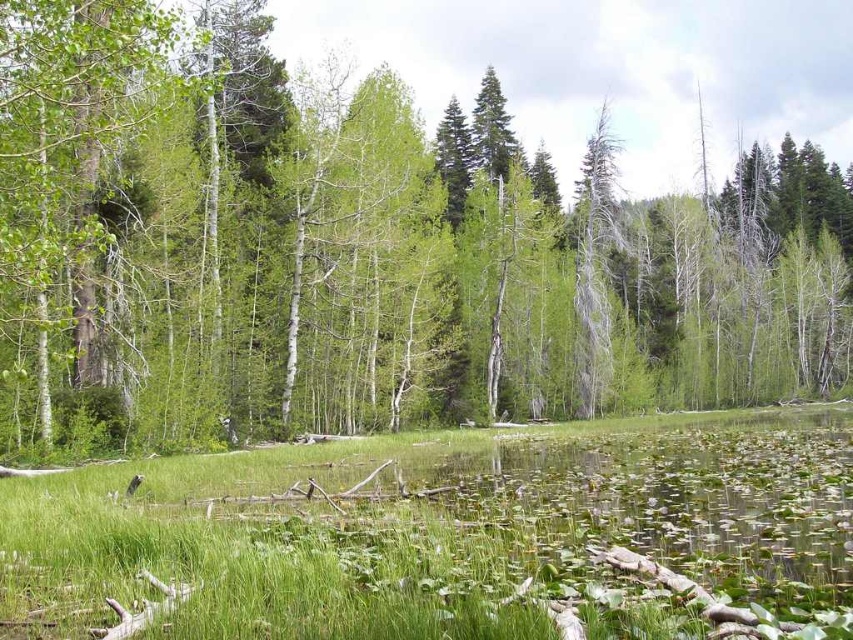
You are a hiker standing at the edge of the pond looking towards the center of the image. You see the green matte tree at center and the green grass at center. Which object is closer to you?

The green matte tree at center is closer to you because the green grass at center is behind it.

You are standing at the point marked by point (x=368, y=248) in the image. What is the nearest object to you?

The nearest object to you is the green matte tree at center marked by point (x=368, y=248).

You are standing in the serene natural landscape described, and you want to take a photo of the green matte tree at center. If your camera has a maximum focus range of 10 meters, will you be able to capture the tree clearly?

The green matte tree at center is 9.54 meters from viewer, so yes, the camera can focus on it clearly since it is within the 10 meters range.